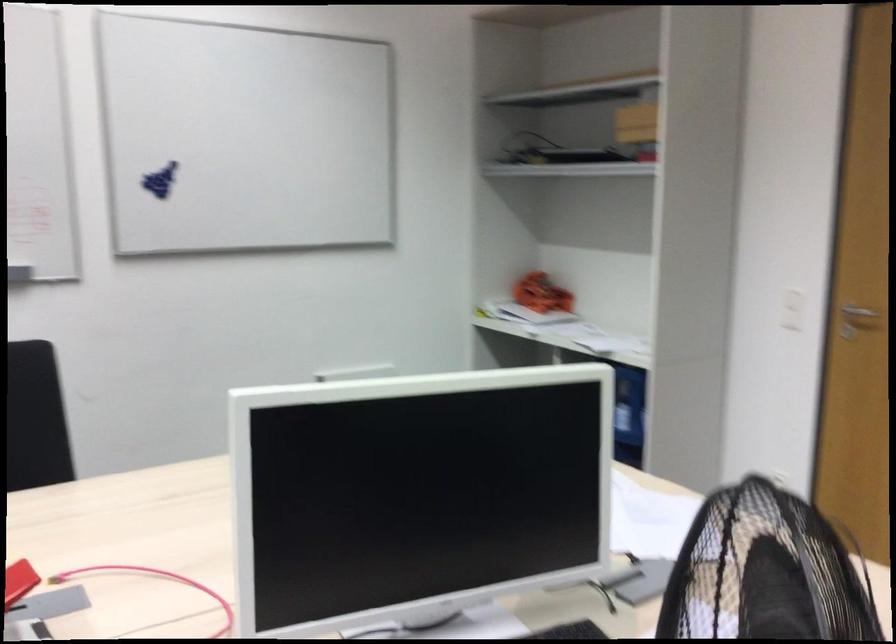
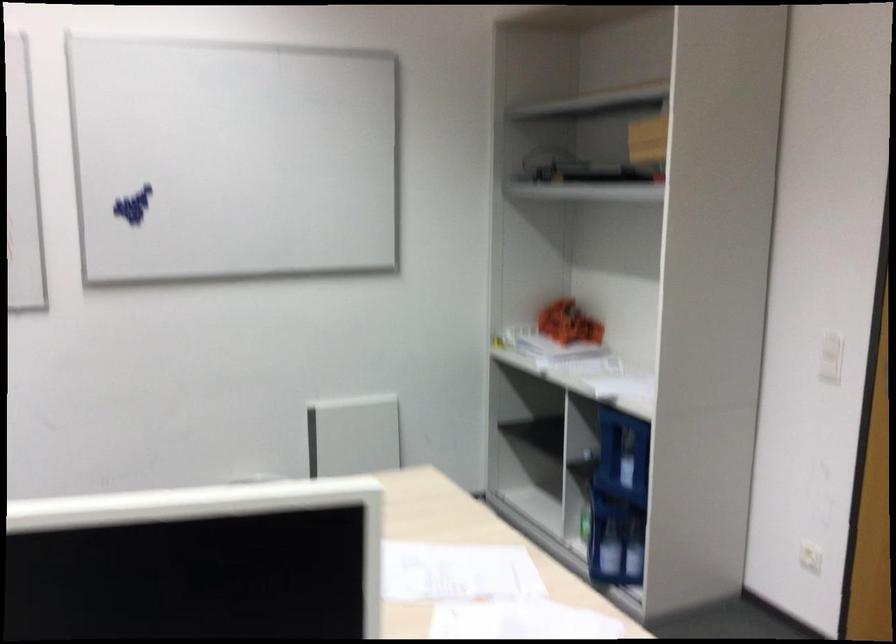
Question: The camera is either moving clockwise (left) or counter-clockwise (right) around the object. The first image is from the beginning of the video and the second image is from the end. Is the camera moving left or right when shooting the video?

Choices:
 (A) Left
 (B) Right

Answer: (B)